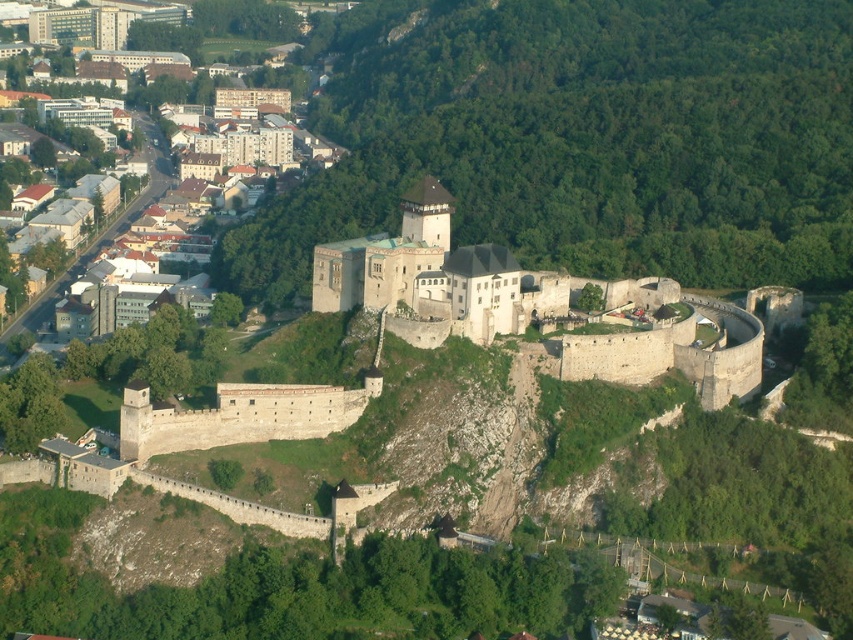
Does stone wall at center appear under light brown wooden houses at lower left?

Indeed, stone wall at center is positioned under light brown wooden houses at lower left.

This screenshot has height=640, width=853. What do you see at coordinates (537, 305) in the screenshot? I see `stone wall at center` at bounding box center [537, 305].

This screenshot has height=640, width=853. Identify the location of stone wall at center. (537, 305).

Find the location of a particular element. stone wall at center is located at coordinates (537, 305).